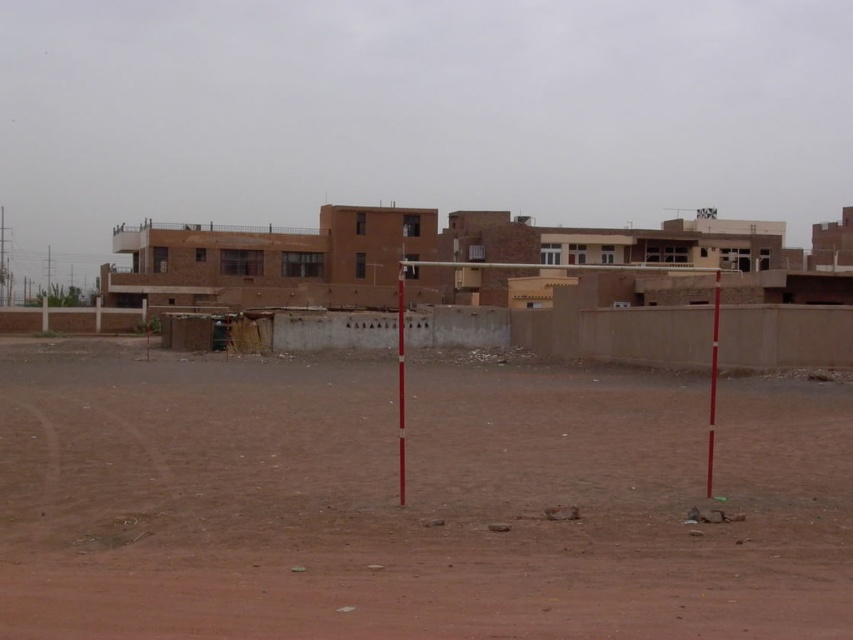
How far apart are brown concrete pole at center and smooth wood pole at center?

The distance of brown concrete pole at center from smooth wood pole at center is 43.21 feet.

Does brown concrete pole at center appear under smooth wood pole at center?

No.

Who is more distant from viewer, (399,444) or (711,429)?

Point (711,429)

This screenshot has height=640, width=853. I want to click on brown concrete pole at center, so pyautogui.click(x=399, y=381).

Can you confirm if brown dirt field at center is thinner than smooth wood pole at center?

In fact, brown dirt field at center might be wider than smooth wood pole at center.

Who is more distant from viewer, [560,476] or [708,449]?

Positioned behind is point [708,449].

Is point (685, 426) farther from viewer compared to point (709, 483)?

Yes, point (685, 426) is farther from viewer.

You are a GUI agent. You are given a task and a screenshot of the screen. Output one action in this format:
    pyautogui.click(x=<x>, y=<y>)
    Task: Click on the brown dirt field at center
    
    Given the screenshot: What is the action you would take?
    pyautogui.click(x=409, y=502)

Is brown dirt field at center shorter than brown concrete pole at center?

Indeed, brown dirt field at center has a lesser height compared to brown concrete pole at center.

Who is more forward, (137,577) or (397,385)?

Point (137,577)

Identify the location of brown dirt field at center. (409, 502).